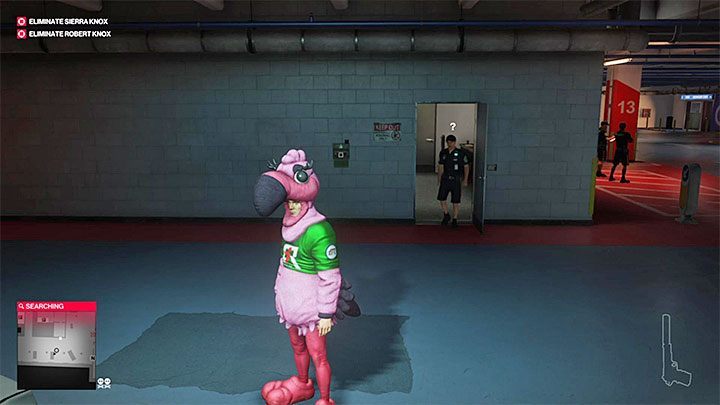
At what (x,y) coordinates should I click in order to perform the action: click on column. Please return your answer as a coordinate pair (x, y). Image resolution: width=720 pixels, height=405 pixels. Looking at the image, I should click on (624, 89).